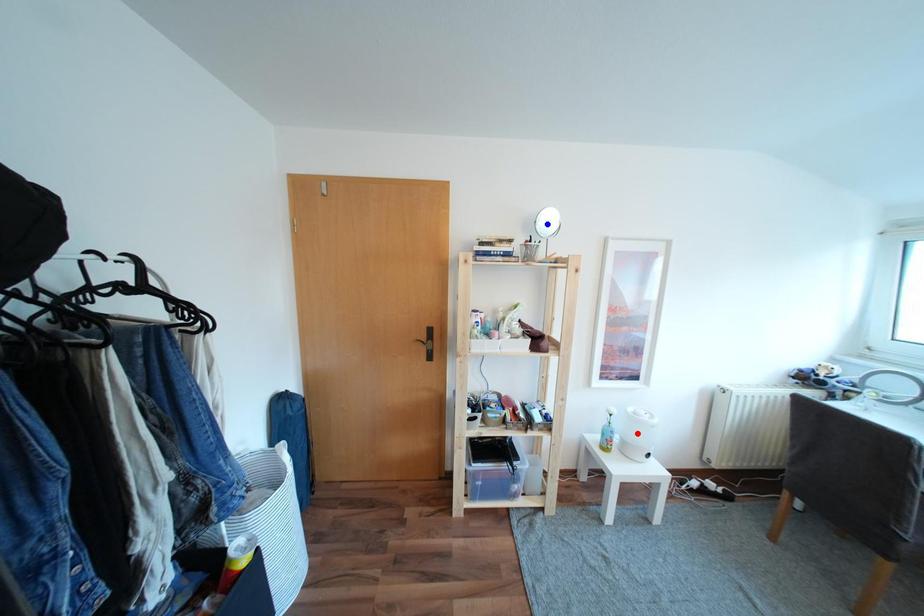
Question: Which of the two points in the image is closer to the camera?

Choices:
 (A) Blue point is closer.
 (B) Red point is closer.

Answer: (A)